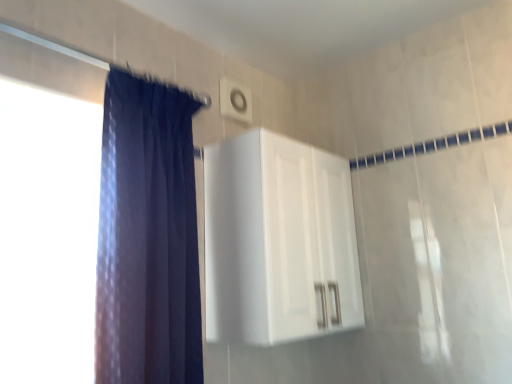
Where is `white plastic light switch at upper center`? white plastic light switch at upper center is located at coordinates (234, 101).

You are a GUI agent. You are given a task and a screenshot of the screen. Output one action in this format:
    pyautogui.click(x=<x>, y=<y>)
    Task: Click on the light switch on the right of dark blue fabric at left
    The width and height of the screenshot is (512, 384).
    Given the screenshot: What is the action you would take?
    pyautogui.click(x=234, y=101)

Between point (196, 359) and point (234, 116), which one is positioned in front?

Point (196, 359)

Is dark blue fabric at left to the right of white plastic light switch at upper center from the viewer's perspective?

No, dark blue fabric at left is not to the right of white plastic light switch at upper center.

Is dark blue fabric at left located outside white plastic light switch at upper center?

Yes, dark blue fabric at left is outside of white plastic light switch at upper center.

What's the angular difference between white glossy cabinet at upper center and dark blue fabric at left's facing directions?

They differ by 2.7e-05 degrees in their facing directions.

Consider the image. From the image's perspective, is white glossy cabinet at upper center above dark blue fabric at left?

No, from the image's perspective, white glossy cabinet at upper center is not over dark blue fabric at left.

Who is taller, white glossy cabinet at upper center or dark blue fabric at left?

dark blue fabric at left is taller.

Is white glossy cabinet at upper center to the left or to the right of dark blue fabric at left in the image?

In the image, white glossy cabinet at upper center appears on the right side of dark blue fabric at left.

Is point (209, 193) positioned after point (224, 94)?

No, (209, 193) is in front of (224, 94).

Which object is positioned more to the right, white glossy cabinet at upper center or white plastic light switch at upper center?

Positioned to the right is white glossy cabinet at upper center.

Is white glossy cabinet at upper center outside of white plastic light switch at upper center?

Yes, white glossy cabinet at upper center is not within white plastic light switch at upper center.

Identify the location of dresser lying below the dark blue fabric at left (from the image's perspective). (278, 241).

Considering the sizes of objects dark blue fabric at left and white glossy cabinet at upper center in the image provided, who is bigger, dark blue fabric at left or white glossy cabinet at upper center?

white glossy cabinet at upper center is bigger.

Which is closer, (128, 350) or (244, 272)?

The point (128, 350) is closer to the camera.

Which of these two, dark blue fabric at left or white glossy cabinet at upper center, stands shorter?

With less height is white glossy cabinet at upper center.

Which object is further away from the camera, white plastic light switch at upper center or white glossy cabinet at upper center?

white plastic light switch at upper center is further away from the camera.

Looking at this image, is white plastic light switch at upper center touching white glossy cabinet at upper center?

No, white plastic light switch at upper center is not in contact with white glossy cabinet at upper center.

Considering the positions of points (227, 97) and (280, 178), is point (227, 97) closer to camera compared to point (280, 178)?

No, it is not.

Is white plastic light switch at upper center to the left of dark blue fabric at left from the viewer's perspective?

No.

From the image's perspective, does white plastic light switch at upper center appear higher than dark blue fabric at left?

Correct, white plastic light switch at upper center appears higher than dark blue fabric at left in the image.

How different are the orientations of white plastic light switch at upper center and dark blue fabric at left in degrees?

The angular difference between white plastic light switch at upper center and dark blue fabric at left is 0.162 degrees.

Can you confirm if white plastic light switch at upper center is smaller than dark blue fabric at left?

Indeed, white plastic light switch at upper center has a smaller size compared to dark blue fabric at left.

Identify the location of curtain to the left of white plastic light switch at upper center. (147, 237).

Locate an element on the screen. This screenshot has width=512, height=384. dresser below the dark blue fabric at left (from the image's perspective) is located at coordinates (278, 241).

Estimate the real-world distances between objects in this image. Which object is further from dark blue fabric at left, white plastic light switch at upper center or white glossy cabinet at upper center?

Among the two, white plastic light switch at upper center is located further to dark blue fabric at left.

When comparing their distances from white plastic light switch at upper center, does dark blue fabric at left or white glossy cabinet at upper center seem closer?

white glossy cabinet at upper center.

Looking at the image, which one is located closer to dark blue fabric at left, white glossy cabinet at upper center or white plastic light switch at upper center?

white glossy cabinet at upper center lies closer to dark blue fabric at left than the other object.

Based on their spatial positions, is white plastic light switch at upper center or dark blue fabric at left closer to white glossy cabinet at upper center?

dark blue fabric at left is closer to white glossy cabinet at upper center.

Looking at the image, which one is located further to white glossy cabinet at upper center, dark blue fabric at left or white plastic light switch at upper center?

Among the two, white plastic light switch at upper center is located further to white glossy cabinet at upper center.

Based on their spatial positions, is white glossy cabinet at upper center or dark blue fabric at left closer to white plastic light switch at upper center?

white glossy cabinet at upper center is positioned closer to the anchor white plastic light switch at upper center.

Identify the location of dresser between dark blue fabric at left and white plastic light switch at upper center in the front-back direction. This screenshot has height=384, width=512. (278, 241).